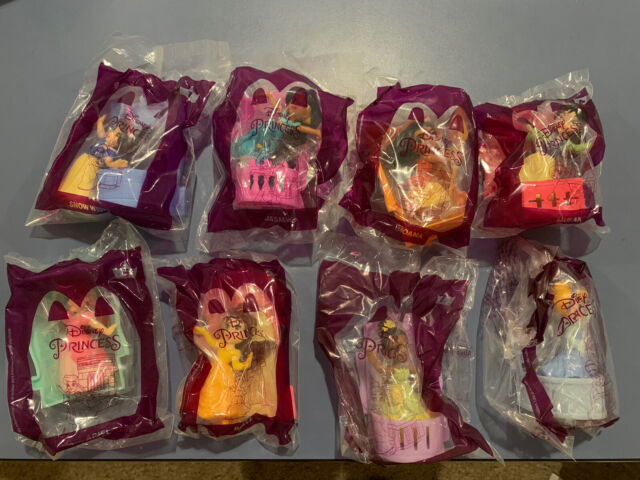
Where is `toys`? toys is located at coordinates (95, 161), (116, 296), (192, 328), (285, 189), (384, 173), (410, 310), (527, 306), (532, 120).